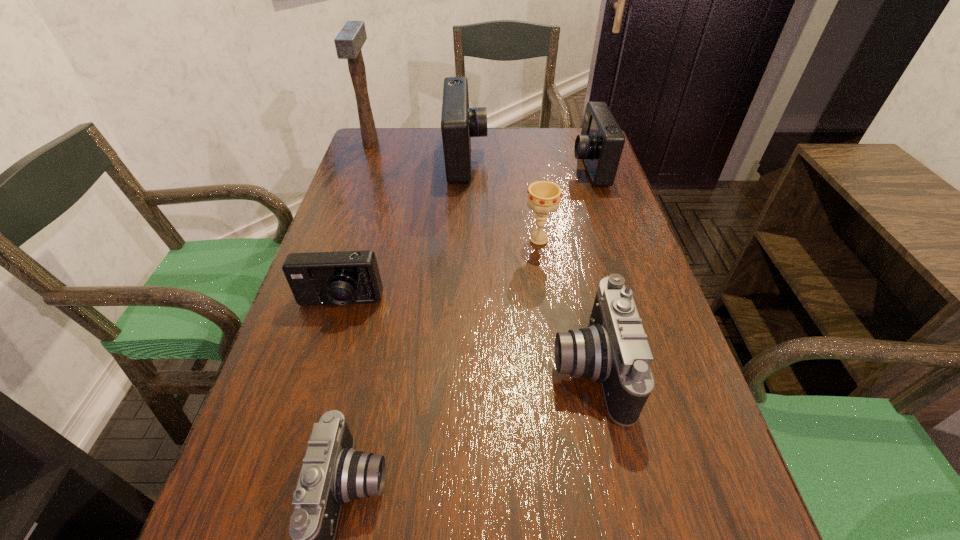
Locate an element on the screen. vacant space in between the right black camera and the leftmost blue camera is located at coordinates (465, 335).

The image size is (960, 540). I want to click on free space that is in between the smallest blue camera and the second nearest object, so click(x=465, y=335).

I want to click on empty space between the tallest object and the fourth farthest object, so click(x=455, y=192).

Find the location of a particular element. vacant area that lies between the third farthest camera and the tallest camera is located at coordinates (403, 232).

Where is `unoccupied position between the mallet and the second tallest object`? unoccupied position between the mallet and the second tallest object is located at coordinates (419, 152).

Choose which object is the nearest neighbor to the third camera from left to right. Please provide its 2D coordinates. Your answer should be formatted as a tuple, i.e. [(x, y)], where the tuple contains the x and y coordinates of a point satisfying the conditions above.

[(543, 196)]

This screenshot has height=540, width=960. In order to click on object that is the fifth closest to the fourth farthest object in this screenshot , I will do `click(333, 473)`.

Find the location of a particular element. The width and height of the screenshot is (960, 540). camera that is the closest to the chalice is located at coordinates (600, 145).

You are a GUI agent. You are given a task and a screenshot of the screen. Output one action in this format:
    pyautogui.click(x=<x>, y=<y>)
    Task: Click on the camera identified as the second closest to the fourth object from right to left
    The image size is (960, 540).
    Given the screenshot: What is the action you would take?
    pyautogui.click(x=343, y=277)

Locate which blue camera is the second closest to the rightmost blue camera. Please provide its 2D coordinates. Your answer should be formatted as a tuple, i.e. [(x, y)], where the tuple contains the x and y coordinates of a point satisfying the conditions above.

[(343, 277)]